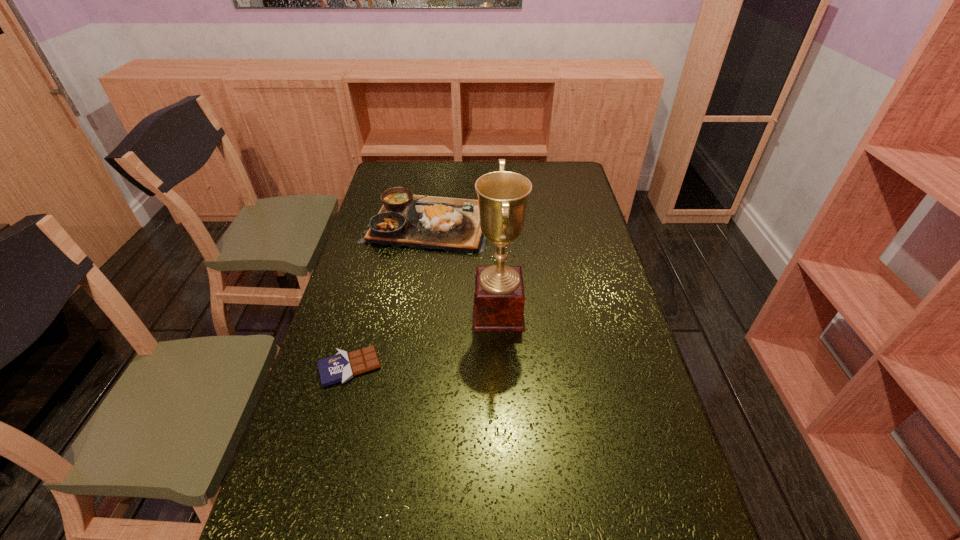
This screenshot has width=960, height=540. Identify the location of vacant area situated 0.200m on the front of the nearest object. (324, 465).

At what (x,y) coordinates should I click in order to perform the action: click on platter at the left edge. Please return your answer as a coordinate pair (x, y). The image size is (960, 540). Looking at the image, I should click on (416, 221).

At what (x,y) coordinates should I click in order to perform the action: click on chocolate bar located at the left edge. Please return your answer as a coordinate pair (x, y). Image resolution: width=960 pixels, height=540 pixels. Looking at the image, I should click on (343, 366).

This screenshot has height=540, width=960. In the image, there is a desktop. Find the location of `vacant space at the left edge`. vacant space at the left edge is located at coordinates (305, 464).

In the image, there is a desktop. Identify the location of blank space at the right edge. (619, 350).

At what (x,y) coordinates should I click in order to perform the action: click on vacant space at the far left corner. Please return your answer as a coordinate pair (x, y). The image size is (960, 540). Looking at the image, I should click on (401, 162).

Locate an element on the screen. free space at the far right corner of the desktop is located at coordinates (579, 177).

Where is `vacant space that's between the second tallest object and the second nearest object`? This screenshot has width=960, height=540. vacant space that's between the second tallest object and the second nearest object is located at coordinates (464, 268).

At what (x,y) coordinates should I click in order to perform the action: click on vacant point located between the trophy cup and the chocolate bar. Please return your answer as a coordinate pair (x, y). Looking at the image, I should click on (424, 340).

The width and height of the screenshot is (960, 540). What are the coordinates of `blank region between the platter and the second farthest object` in the screenshot? It's located at (464, 268).